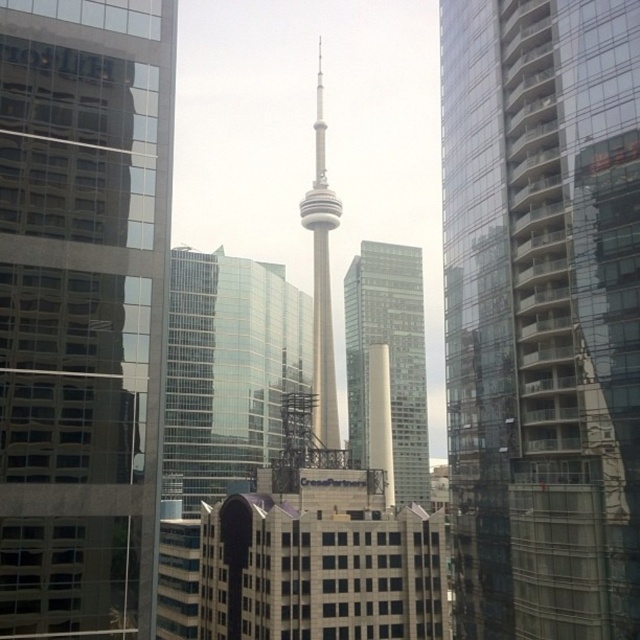
Which is more to the right, transparent glass skyscraper at left or white glass tower at center?

Positioned to the right is white glass tower at center.

What do you see at coordinates (83, 310) in the screenshot? I see `transparent glass skyscraper at left` at bounding box center [83, 310].

Which is in front, point (29, 401) or point (412, 346)?

Positioned in front is point (29, 401).

You are a GUI agent. You are given a task and a screenshot of the screen. Output one action in this format:
    pyautogui.click(x=<x>, y=<y>)
    Task: Click on the transparent glass skyscraper at left
    This screenshot has height=640, width=640.
    Given the screenshot: What is the action you would take?
    pyautogui.click(x=83, y=310)

Can you confirm if transparent glass skyscraper at left is taller than smooth beige tower at center?

No.

Between point (148, 259) and point (317, 376), which one is positioned behind?

The point (317, 376) is behind.

You are a GUI agent. You are given a task and a screenshot of the screen. Output one action in this format:
    pyautogui.click(x=<x>, y=<y>)
    Task: Click on the transparent glass skyscraper at left
    The height and width of the screenshot is (640, 640).
    Given the screenshot: What is the action you would take?
    pyautogui.click(x=83, y=310)

Is transparent glass building at center above smooth beige tower at center?

No.

Is transparent glass building at center taller than smooth beige tower at center?

In fact, transparent glass building at center may be shorter than smooth beige tower at center.

Is point (448, 365) closer to viewer compared to point (321, 230)?

Yes, it is.

Image resolution: width=640 pixels, height=640 pixels. I want to click on transparent glass building at center, so click(541, 314).